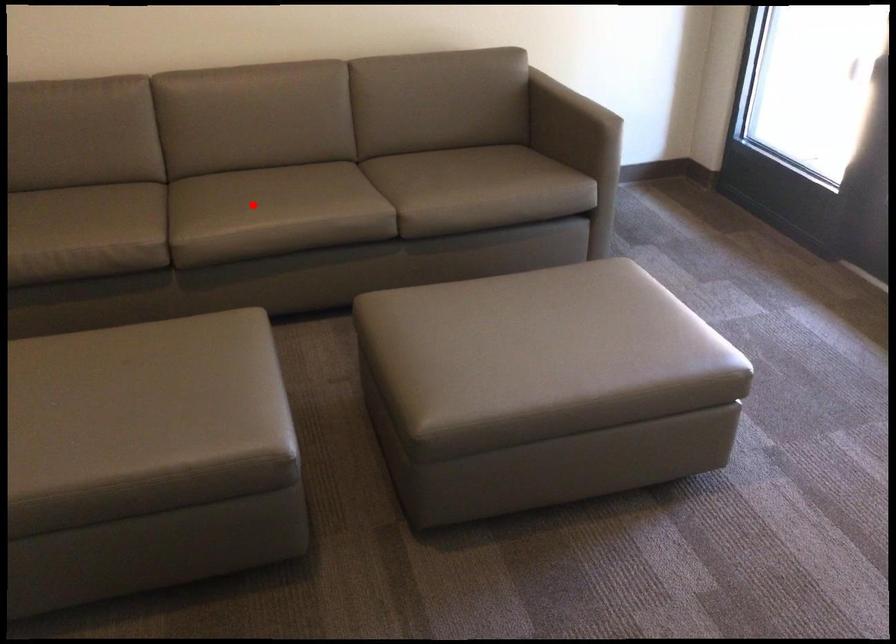
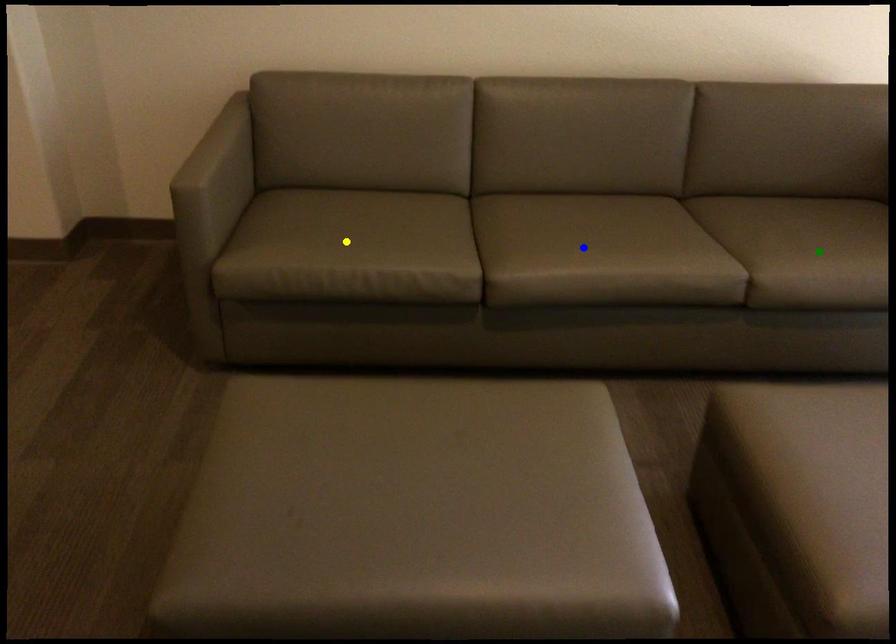
Question: I am providing you with two images of the same scene from different viewpoints. A red point is marked on the first image. You are given multiple points on the second image. In image 2, which mark is for the same physical point as the one in image 1?

Choices:
 (A) yellow point
 (B) blue point
 (C) green point

Answer: (B)